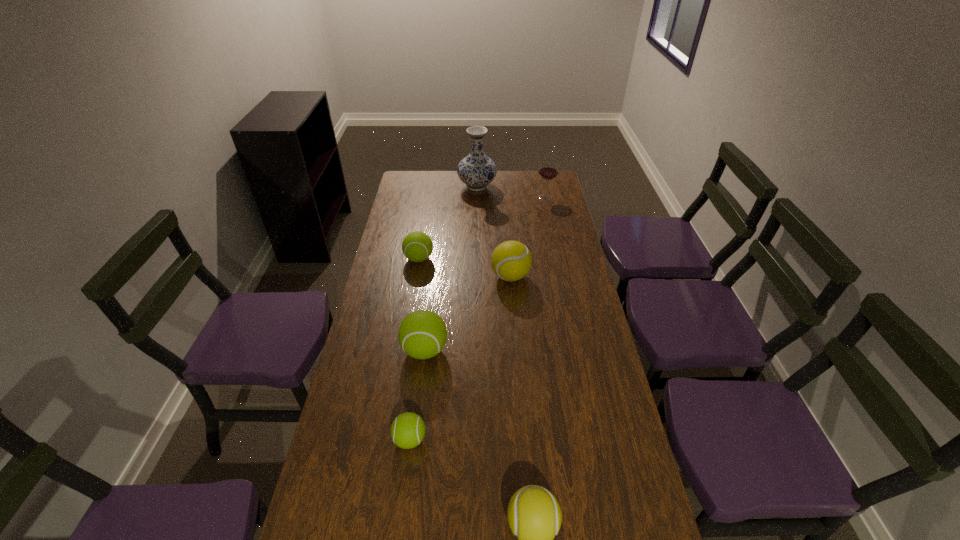
The image size is (960, 540). Find the location of `vacant space located 0.050m on the right of the blue vase`. vacant space located 0.050m on the right of the blue vase is located at coordinates (507, 186).

The height and width of the screenshot is (540, 960). In order to click on free space located on the back of the wineglass in this screenshot , I will do `click(542, 183)`.

Identify the location of free region located on the right of the bigger yellow tennis ball. This screenshot has width=960, height=540. (546, 276).

This screenshot has width=960, height=540. In order to click on vacant space located 0.400m on the back of the second nearest green tennis ball in this screenshot , I will do `click(436, 258)`.

You are a GUI agent. You are given a task and a screenshot of the screen. Output one action in this format:
    pyautogui.click(x=<x>, y=<y>)
    Task: Click on the blank space located on the right of the farthest green tennis ball
    This screenshot has height=540, width=960.
    Given the screenshot: What is the action you would take?
    pyautogui.click(x=484, y=259)

The image size is (960, 540). Identify the location of vacant space located on the right of the shortest object. (532, 440).

The image size is (960, 540). Identify the location of vase that is at the far edge. (476, 170).

Locate an element on the screen. wineglass at the far edge is located at coordinates (548, 170).

I want to click on object that is at the right edge, so click(x=548, y=170).

This screenshot has width=960, height=540. What are the coordinates of `object that is at the far right corner` in the screenshot? It's located at (548, 170).